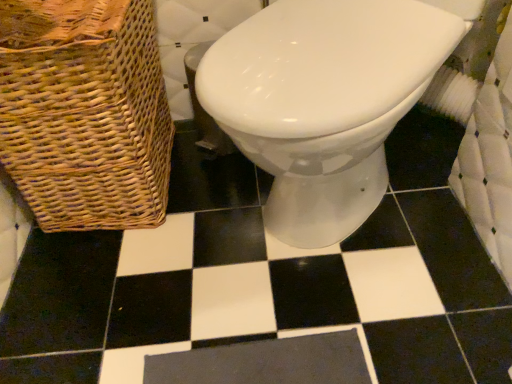
This screenshot has width=512, height=384. Describe the element at coordinates (85, 112) in the screenshot. I see `woven brown basket at left` at that location.

Locate an element on the screen. This screenshot has width=512, height=384. woven brown basket at left is located at coordinates (85, 112).

Measure the distance between woven brown basket at left and camera.

A distance of 25.39 inches exists between woven brown basket at left and camera.

What is the approximate height of white glossy toilet at center?

The height of white glossy toilet at center is 61.36 centimeters.

The image size is (512, 384). What do you see at coordinates (323, 102) in the screenshot?
I see `white glossy toilet at center` at bounding box center [323, 102].

You are a GUI agent. You are given a task and a screenshot of the screen. Output one action in this format:
    pyautogui.click(x=<x>, y=<y>)
    Task: Click on the white glossy toilet at center
    This screenshot has width=512, height=384.
    Given the screenshot: What is the action you would take?
    pyautogui.click(x=323, y=102)

Locate an element on the screen. Image resolution: width=512 pixels, height=384 pixels. woven brown basket at left is located at coordinates (85, 112).

Can you confirm if woven brown basket at left is positioned to the left of white glossy toilet at center?

Yes.

Between woven brown basket at left and white glossy toilet at center, which one is positioned behind?

woven brown basket at left is further from the camera.

Which point is more forward, (29,73) or (298,159)?

The point (298,159) is more forward.

From the image's perspective, is woven brown basket at left above or below white glossy toilet at center?

Clearly, from the image's perspective, woven brown basket at left is above white glossy toilet at center.

From a real-world perspective, is woven brown basket at left over white glossy toilet at center?

No.

Between woven brown basket at left and white glossy toilet at center, which one has smaller width?

With smaller width is woven brown basket at left.

Between woven brown basket at left and white glossy toilet at center, which one has more height?

white glossy toilet at center is taller.

Which of these two, woven brown basket at left or white glossy toilet at center, is smaller?

With smaller size is woven brown basket at left.

Is woven brown basket at left spatially inside white glossy toilet at center, or outside of it?

woven brown basket at left is located beyond the bounds of white glossy toilet at center.

Is the surface of woven brown basket at left in direct contact with white glossy toilet at center?

No.

Is woven brown basket at left looking in the opposite direction of white glossy toilet at center?

No.

Can you tell me how much woven brown basket at left and white glossy toilet at center differ in facing direction?

41.5 degrees.

Measure the distance from woven brown basket at left to white glossy toilet at center.

woven brown basket at left and white glossy toilet at center are 13.26 inches apart.

Identify the location of toilet lying in front of the woven brown basket at left. (323, 102).

Which is more to the left, white glossy toilet at center or woven brown basket at left?

From the viewer's perspective, woven brown basket at left appears more on the left side.

Between white glossy toilet at center and woven brown basket at left, which one is positioned behind?

woven brown basket at left is behind.

Does point (443, 40) appear closer or farther from the camera than point (93, 129)?

Point (443, 40) is positioned closer to the camera compared to point (93, 129).

From the image's perspective, is white glossy toilet at center under woven brown basket at left?

Indeed, from the image's perspective, white glossy toilet at center is shown beneath woven brown basket at left.

From a real-world perspective, is white glossy toilet at center above or below woven brown basket at left?

white glossy toilet at center is above woven brown basket at left.

In terms of width, does white glossy toilet at center look wider or thinner when compared to woven brown basket at left?

white glossy toilet at center is wider than woven brown basket at left.

Can you confirm if white glossy toilet at center is shorter than woven brown basket at left?

No.

In the scene shown: Based on their sizes in the image, would you say white glossy toilet at center is bigger or smaller than woven brown basket at left?

Considering their sizes, white glossy toilet at center takes up more space than woven brown basket at left.

Is white glossy toilet at center inside the boundaries of woven brown basket at left, or outside?

The correct answer is: outside.

Is white glossy toilet at center in contact with woven brown basket at left?

No, white glossy toilet at center is not next to woven brown basket at left.

Is white glossy toilet at center facing away from woven brown basket at left?

white glossy toilet at center does not have its back to woven brown basket at left.

You are a GUI agent. You are given a task and a screenshot of the screen. Output one action in this format:
    pyautogui.click(x=<x>, y=<y>)
    Task: Click on the basket directly beneath the white glossy toilet at center (from a real-world perspective)
    The image size is (512, 384).
    Given the screenshot: What is the action you would take?
    pyautogui.click(x=85, y=112)

At what (x,y) coordinates should I click in order to perform the action: click on toilet above the woven brown basket at left (from a real-world perspective). Please return your answer as a coordinate pair (x, y). The width and height of the screenshot is (512, 384). Looking at the image, I should click on (323, 102).

In order to click on basket below the white glossy toilet at center (from a real-world perspective) in this screenshot , I will do tap(85, 112).